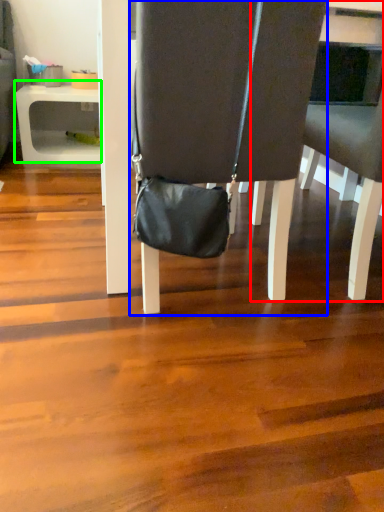
Question: Which is farther away from chair (highlighted by a red box)? chair (highlighted by a blue box) or table (highlighted by a green box)?

Choices:
 (A) chair
 (B) table

Answer: (B)